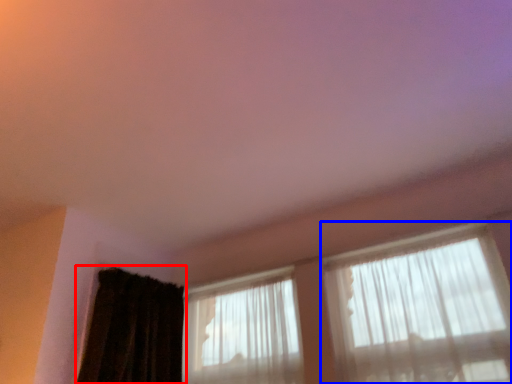
Question: Which point is further to the camera, curtain (highlighted by a red box) or window (highlighted by a blue box)?

Choices:
 (A) curtain
 (B) window

Answer: (A)